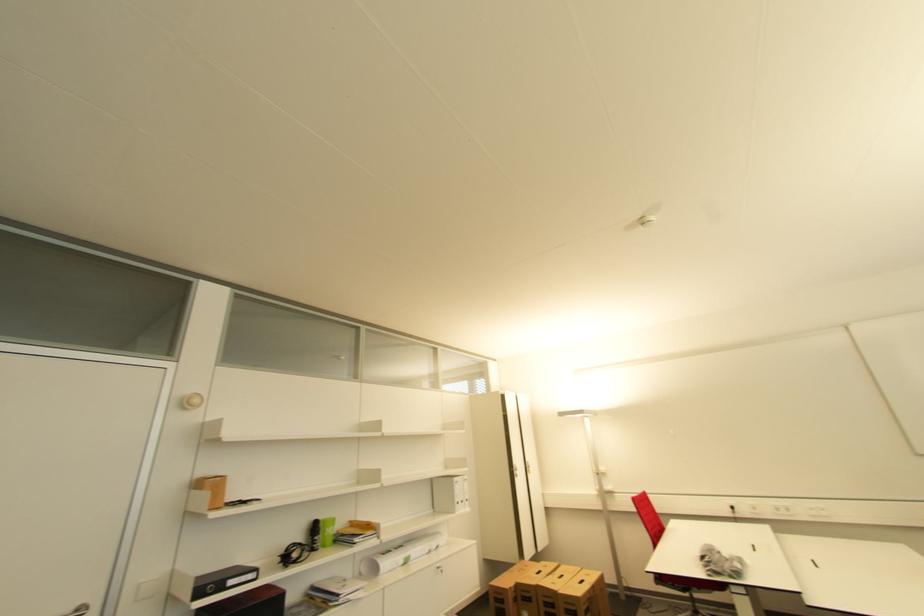
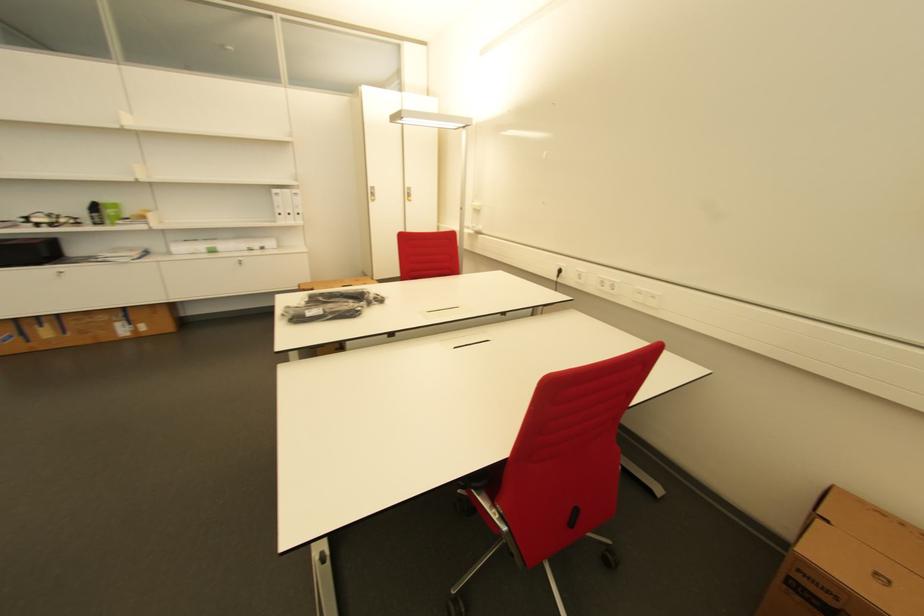
Locate, in the second image, the point that corresponds to the point at 321,529 in the first image.

(100, 209)